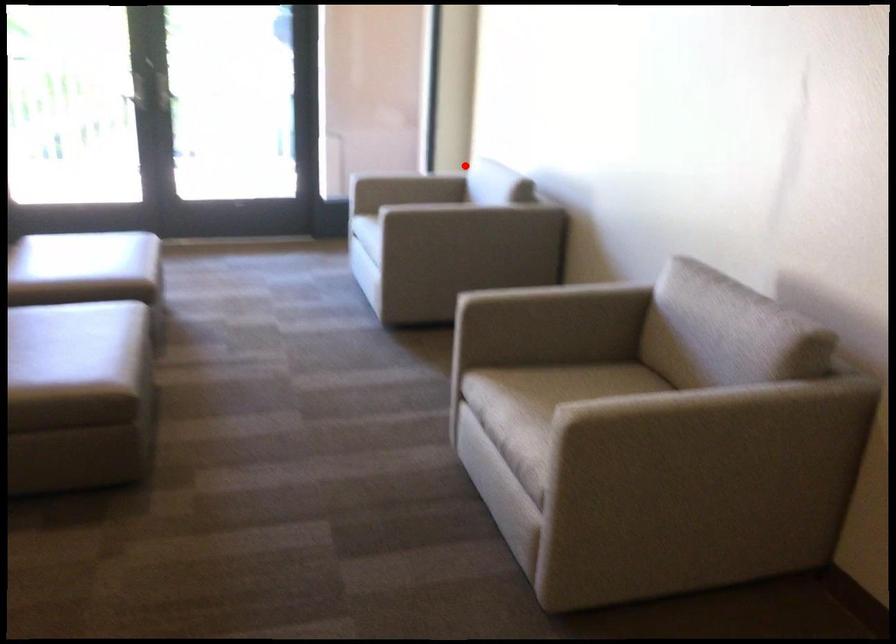
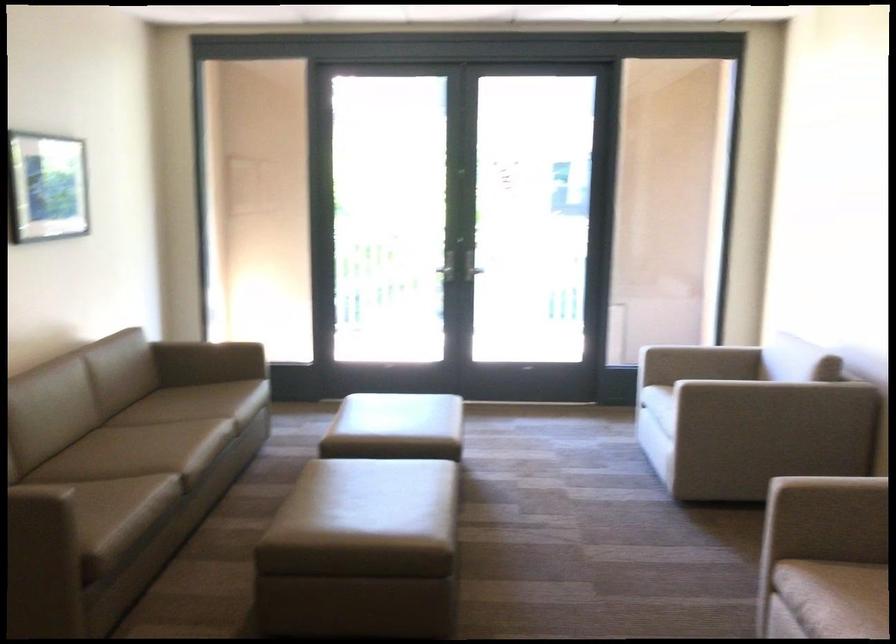
Locate, in the second image, the point that corresponds to the highlighted location in the first image.

(762, 346)